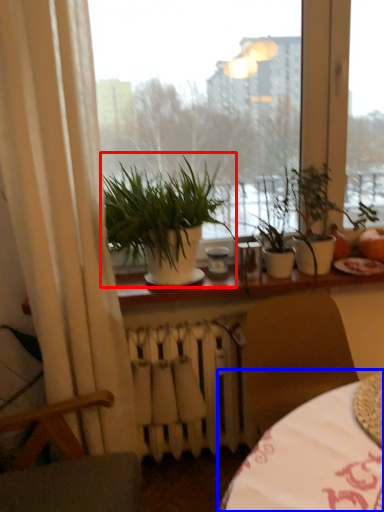
Question: Which of the following is the farthest to the observer, houseplant (highlighted by a red box) or table (highlighted by a blue box)?

Choices:
 (A) houseplant
 (B) table

Answer: (A)